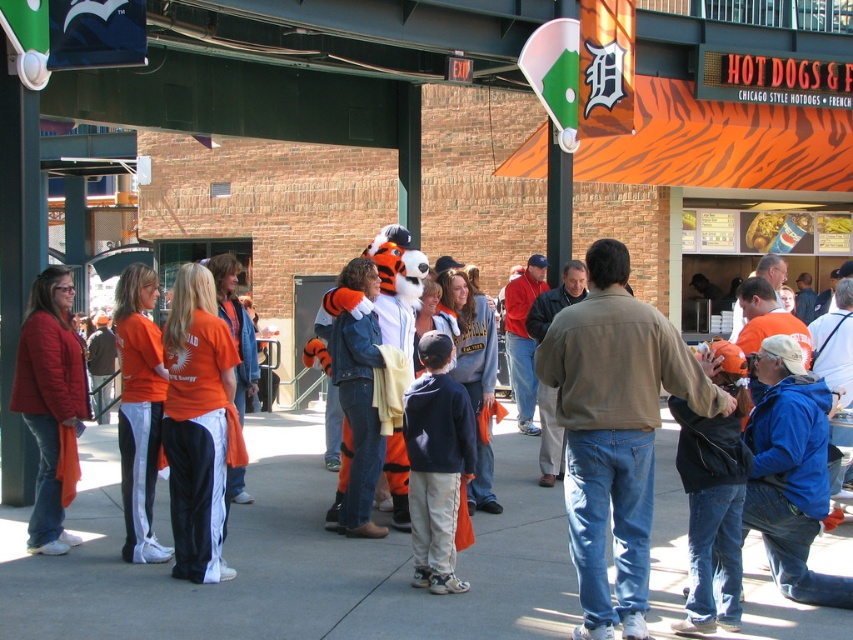
You are standing at the point closer to the camera in the image. Which point are you at, point (747, 554) or point (460, 458)?

You are at point (460, 458) because it is closer to the camera compared to point (747, 554), which is further away.

You are a photographer at the stadium and want to capture both the blue fleece jacket at right and the black leather jacket at center in a single shot. Which jacket should you position closer to the left side of your camera frame to ensure both are visible?

The blue fleece jacket at right is positioned on the right side of black leather jacket at center. To include both in the shot, position the black leather jacket at center closer to the left side of the frame so the blue fleece jacket at right can be on the right.